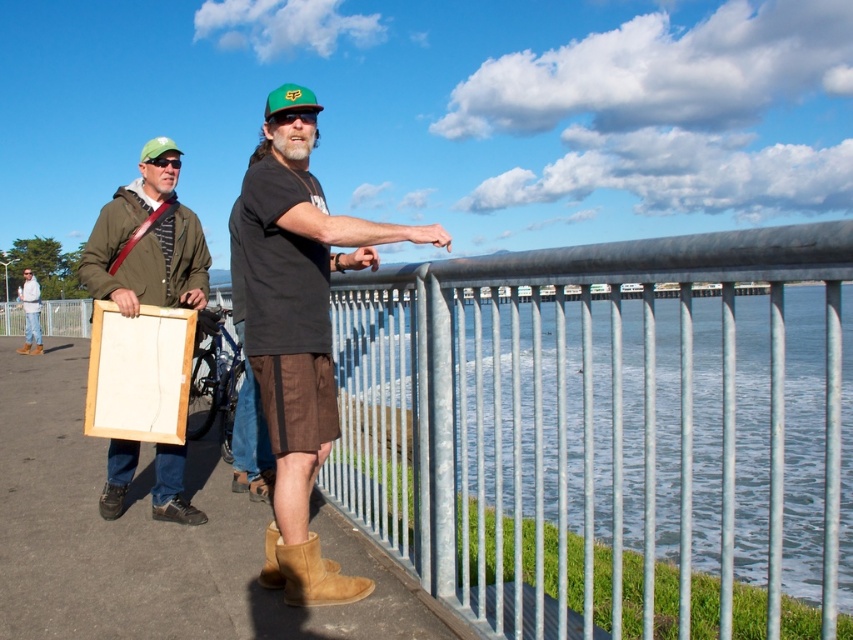
Question: Does tan suede boot at lower center come in front of denim jacket at left?

Choices:
 (A) no
 (B) yes

Answer: (B)

Question: Which point is closer to the camera taking this photo?

Choices:
 (A) (279, 348)
 (B) (273, 573)

Answer: (A)

Question: Which of the following is the farthest from the observer?

Choices:
 (A) clear blue water at center
 (B) wooden frame at left
 (C) denim jacket at left
 (D) brown suede boots at center

Answer: (C)

Question: Which point is closer to the camera taking this photo?

Choices:
 (A) [283, 580]
 (B) [289, 150]
 (C) [317, 570]
 (D) [668, 416]

Answer: (B)

Question: Does brown suede boots at center appear on the right side of tan suede boot at lower center?

Choices:
 (A) no
 (B) yes

Answer: (A)

Question: Can you confirm if wooden frame at left is positioned below tan suede boot at lower center?

Choices:
 (A) yes
 (B) no

Answer: (B)